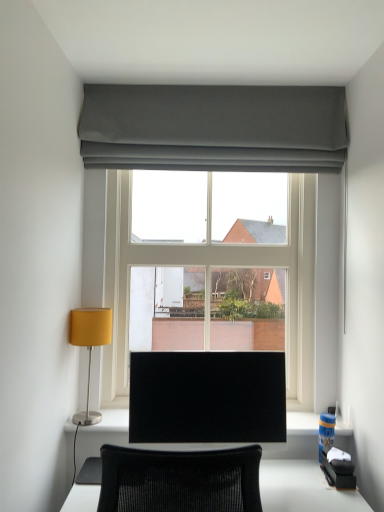
I want to click on clear glass window at center, so click(213, 127).

Between point (307, 87) and point (159, 89), which one is positioned in front?

The point (307, 87) is in front.

Is dark gray fabric at upper center at the back of clear glass window at center?

clear glass window at center does not have its back to dark gray fabric at upper center.

Which is behind, clear glass window at center or dark gray fabric at upper center?

clear glass window at center is further away from the camera.

From the image's perspective, which one is positioned higher, clear glass window at center or dark gray fabric at upper center?

dark gray fabric at upper center, from the image's perspective.

From the picture: Is matte yellow lampshade at left wider or thinner than dark gray fabric at upper center?

In the image, matte yellow lampshade at left appears to be wider than dark gray fabric at upper center.

From the image's perspective, is matte yellow lampshade at left located above dark gray fabric at upper center?

No, from the image's perspective, matte yellow lampshade at left is not above dark gray fabric at upper center.

From a real-world perspective, who is located lower, matte yellow lampshade at left or dark gray fabric at upper center?

matte yellow lampshade at left.

From a real-world perspective, between clear glass window at center and matte yellow lampshade at left, who is vertically higher?

→ clear glass window at center, from a real-world perspective.

From the image's perspective, relative to matte yellow lampshade at left, is clear glass window at center above or below?

clear glass window at center is situated higher than matte yellow lampshade at left in the image.

Does clear glass window at center lie behind matte yellow lampshade at left?

Yes, it is.

Does clear glass window at center appear on the left side of matte yellow lampshade at left?

No, clear glass window at center is not to the left of matte yellow lampshade at left.

Which is in front, point (91, 326) or point (184, 147)?

Point (91, 326)

How far apart are matte yellow lampshade at left and clear glass window at center?

33.26 inches.

Based on their sizes in the image, would you say matte yellow lampshade at left is bigger or smaller than clear glass window at center?

matte yellow lampshade at left is smaller than clear glass window at center.

From a real-world perspective, is matte yellow lampshade at left located beneath clear glass window at center?

Yes, from a real-world perspective, matte yellow lampshade at left is under clear glass window at center.

From a real-world perspective, is dark gray fabric at upper center located beneath black glossy monitor at center?

Actually, dark gray fabric at upper center is physically above black glossy monitor at center in the real world.

From the image's perspective, which one is positioned higher, dark gray fabric at upper center or black glossy monitor at center?

From the image's view, dark gray fabric at upper center is above.

Based on the photo, is black glossy monitor at center at the back of dark gray fabric at upper center?

dark gray fabric at upper center is not turned away from black glossy monitor at center.

From a real-world perspective, is dark gray fabric at upper center located beneath clear glass window at center?

No.

Looking at this image, from the image's perspective, does dark gray fabric at upper center appear higher than clear glass window at center?

Indeed, from the image's perspective, dark gray fabric at upper center is shown above clear glass window at center.

Can you see matte yellow lampshade at left touching black glossy monitor at center?

No, matte yellow lampshade at left is not with black glossy monitor at center.

Considering the relative sizes of matte yellow lampshade at left and black glossy monitor at center in the image provided, is matte yellow lampshade at left thinner than black glossy monitor at center?

Incorrect, the width of matte yellow lampshade at left is not less than that of black glossy monitor at center.

Where is `computer monitor located underneath the matte yellow lampshade at left (from a real-world perspective)`? The image size is (384, 512). computer monitor located underneath the matte yellow lampshade at left (from a real-world perspective) is located at coordinates (207, 397).

You are a GUI agent. You are given a task and a screenshot of the screen. Output one action in this format:
    pyautogui.click(x=<x>, y=<y>)
    Task: Click on the curtain on the right of clear glass window at center
    
    Given the screenshot: What is the action you would take?
    213,128

Image resolution: width=384 pixels, height=512 pixels. I want to click on curtain behind the matte yellow lampshade at left, so click(213, 128).

Considering their positions, is clear glass window at center positioned closer to matte yellow lampshade at left than black glossy monitor at center?

black glossy monitor at center lies closer to matte yellow lampshade at left than the other object.

Based on the photo, from the image, which object appears to be nearer to black glossy monitor at center, clear glass window at center or dark gray fabric at upper center?

Based on the image, clear glass window at center appears to be nearer to black glossy monitor at center.

Considering their positions, is matte yellow lampshade at left positioned closer to clear glass window at center than dark gray fabric at upper center?

The object closer to clear glass window at center is dark gray fabric at upper center.

Which object lies nearer to the anchor point dark gray fabric at upper center, black glossy monitor at center or matte yellow lampshade at left?

matte yellow lampshade at left.

When comparing their distances from matte yellow lampshade at left, does black glossy monitor at center or clear glass window at center seem closer?

black glossy monitor at center lies closer to matte yellow lampshade at left than the other object.

Which object lies nearer to the anchor point dark gray fabric at upper center, clear glass window at center or matte yellow lampshade at left?

clear glass window at center.

Looking at this image, which object lies further to the anchor point clear glass window at center, black glossy monitor at center or dark gray fabric at upper center?

The object further to clear glass window at center is black glossy monitor at center.

When comparing their distances from matte yellow lampshade at left, does clear glass window at center or dark gray fabric at upper center seem further?

The object further to matte yellow lampshade at left is dark gray fabric at upper center.

I want to click on table lamp between dark gray fabric at upper center and black glossy monitor at center from top to bottom, so click(x=90, y=346).

The height and width of the screenshot is (512, 384). I want to click on window that lies between dark gray fabric at upper center and matte yellow lampshade at left from top to bottom, so click(x=213, y=127).

This screenshot has height=512, width=384. Find the location of `computer monitor between matte yellow lampshade at left and clear glass window at center from left to right`. computer monitor between matte yellow lampshade at left and clear glass window at center from left to right is located at coordinates (207, 397).

Where is `window that lies between dark gray fabric at upper center and black glossy monitor at center from top to bottom`? window that lies between dark gray fabric at upper center and black glossy monitor at center from top to bottom is located at coordinates (213, 127).